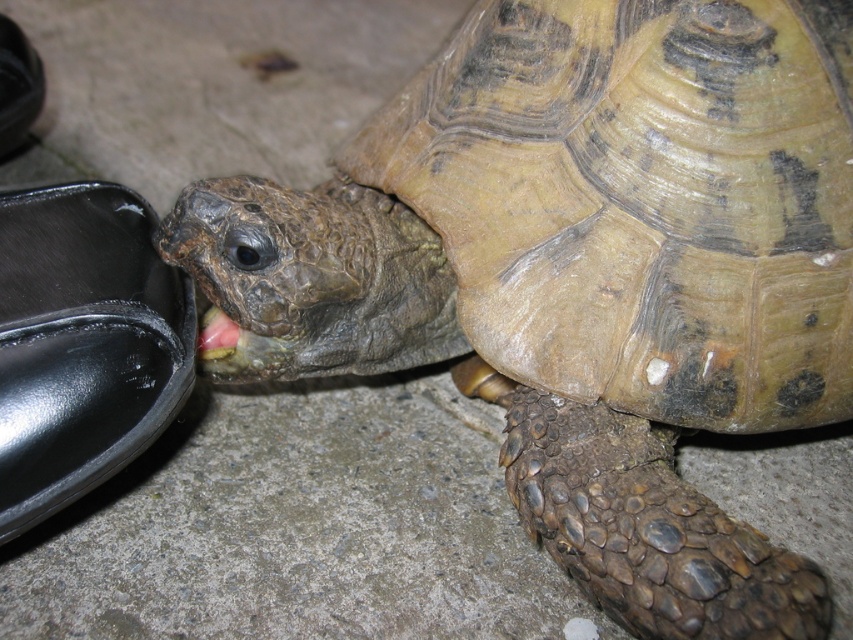
You are a tortoise trying to reach a leaf located at point A. There are two points marked in the image, point A at point (9, 474) and point B at point (18, 136). Which point should you move towards first to get closer to the leaf?

The tortoise should move towards point A at point (9, 474) first because it is closer to the leaf.

From the picture: You are a delivery robot trying to navigate around the shiny black shoe at lower left and the black leather shoe at left. Which shoe should you avoid bumping into first as you move forward?

The shiny black shoe at lower left is in front of the black leather shoe at left, so you should avoid bumping into the shiny black shoe at lower left first as you move forward.